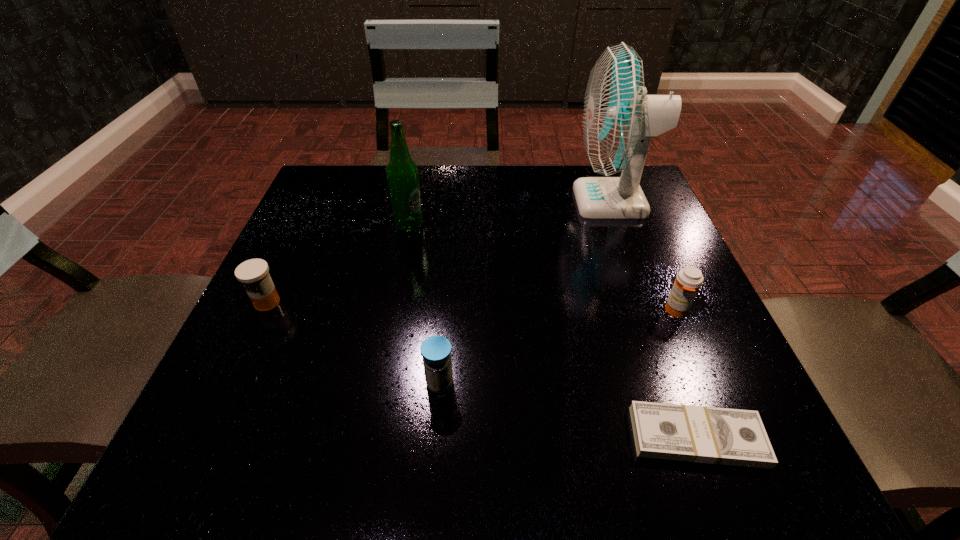
This screenshot has height=540, width=960. Identify the location of object situated at the left edge. (253, 273).

Where is `fan situated at the right edge`? fan situated at the right edge is located at coordinates (619, 119).

The height and width of the screenshot is (540, 960). I want to click on medicine situated at the right edge, so click(688, 281).

This screenshot has width=960, height=540. What are the coordinates of `dollar situated at the right edge` in the screenshot? It's located at (700, 434).

In order to click on object present at the far right corner in this screenshot , I will do `click(619, 119)`.

Locate an element on the screen. This screenshot has width=960, height=540. object that is at the near right corner is located at coordinates (700, 434).

Find the location of `free space at the far edge`. free space at the far edge is located at coordinates pos(424,218).

You are a GUI agent. You are given a task and a screenshot of the screen. Output one action in this format:
    pyautogui.click(x=<x>, y=<y>)
    Task: Click on the vacant space at the near edge of the desktop
    This screenshot has width=960, height=540.
    Given the screenshot: What is the action you would take?
    pyautogui.click(x=454, y=416)

Find the location of `free region at the left edge of the desktop`. free region at the left edge of the desktop is located at coordinates (276, 276).

Where is `vacant area at the right edge of the desktop`? The width and height of the screenshot is (960, 540). vacant area at the right edge of the desktop is located at coordinates (649, 394).